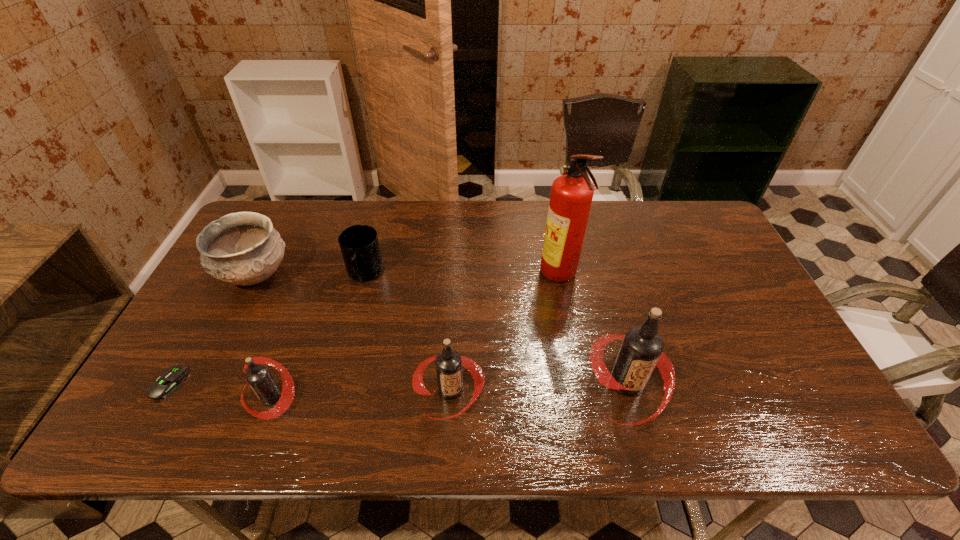
Locate an element on the screen. The width and height of the screenshot is (960, 540). the shortest root beer is located at coordinates (259, 378).

Find the location of a particular element. This screenshot has height=540, width=960. the fifth object from right to left is located at coordinates (259, 378).

You are a GUI agent. You are given a task and a screenshot of the screen. Output one action in this format:
    pyautogui.click(x=<x>, y=<y>)
    Task: Click on the second root beer from right to left
    
    Given the screenshot: What is the action you would take?
    pyautogui.click(x=448, y=363)

This screenshot has height=540, width=960. What are the coordinates of `the third object from right to left` in the screenshot? It's located at (448, 363).

What are the coordinates of `the tallest root beer` in the screenshot? It's located at (641, 350).

Locate an element on the screen. the second tallest object is located at coordinates (641, 350).

Locate an element on the screen. This screenshot has height=540, width=960. the tallest object is located at coordinates (571, 196).

Find the location of `the fourth object from left to right`. the fourth object from left to right is located at coordinates (359, 244).

What are the coordinates of `pottery` in the screenshot? It's located at (243, 248).

The height and width of the screenshot is (540, 960). I want to click on computer mouse, so click(x=170, y=379).